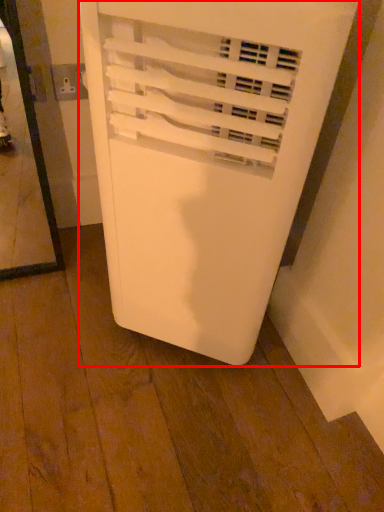
Question: Where is home appliance (annotated by the red box) located in relation to electric outlet in the image?

Choices:
 (A) right
 (B) left

Answer: (A)